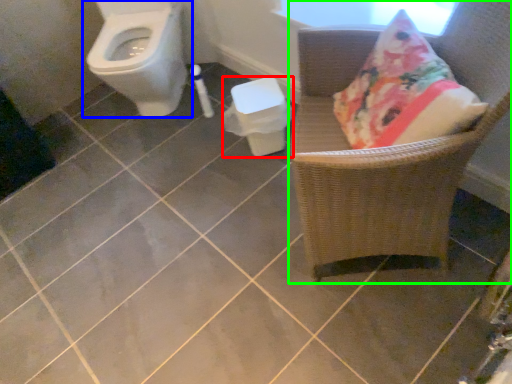
Question: Which object is positioned closest to potty (highlighted by a red box)? Select from toilet (highlighted by a blue box) and chair (highlighted by a green box).

Choices:
 (A) toilet
 (B) chair

Answer: (B)